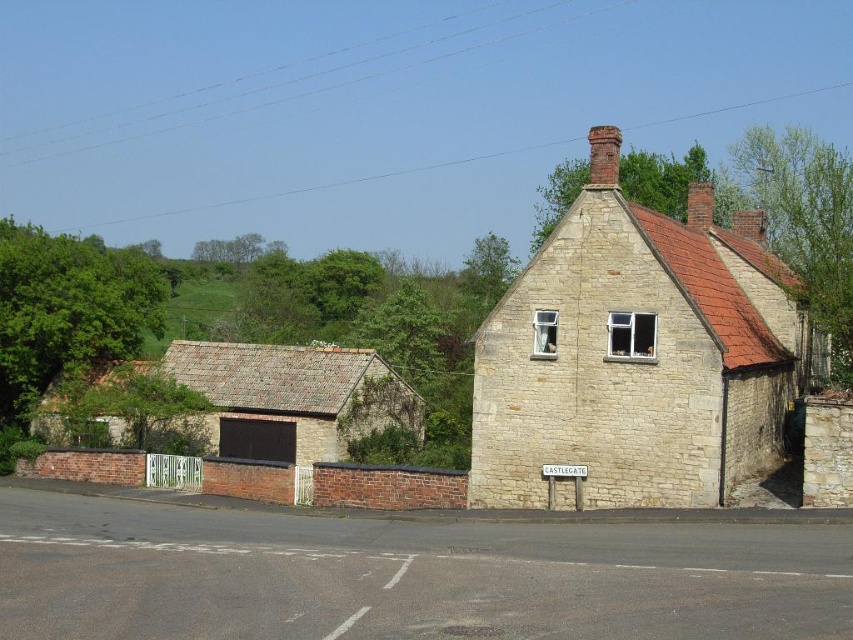
Question: Can you confirm if stone cottage at center is thinner than stone brick cottage at lower left?

Choices:
 (A) yes
 (B) no

Answer: (A)

Question: Can you confirm if stone cottage at center is positioned to the right of stone brick cottage at lower left?

Choices:
 (A) no
 (B) yes

Answer: (B)

Question: Can you confirm if stone cottage at center is positioned to the right of stone brick cottage at lower left?

Choices:
 (A) no
 (B) yes

Answer: (B)